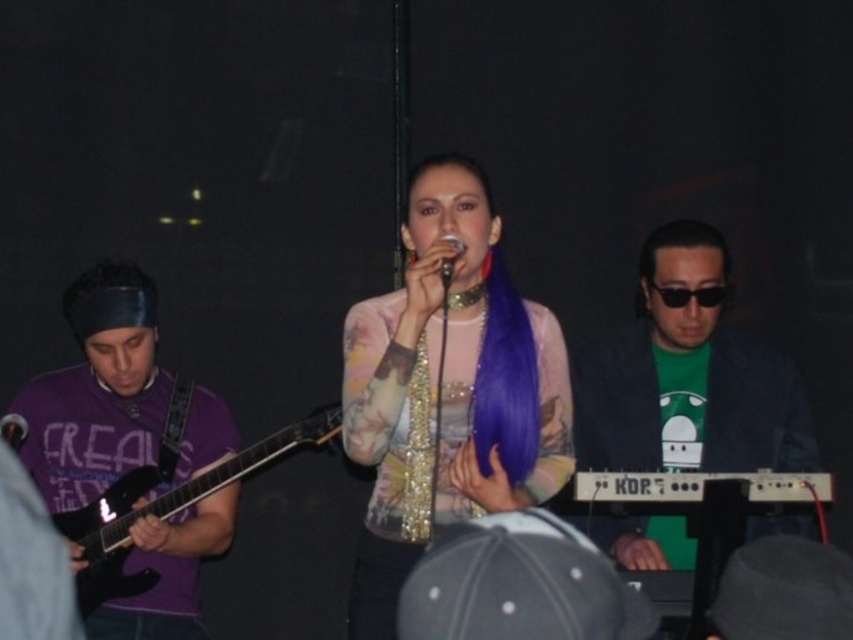
Is green matte keyboard at right bigger than purple matte guitar at left?

Indeed, green matte keyboard at right has a larger size compared to purple matte guitar at left.

Based on the photo, which is more to the left, green matte keyboard at right or purple matte guitar at left?

purple matte guitar at left

Does point (708, 326) lie behind point (198, 534)?

No, it is in front of (198, 534).

At what (x,y) coordinates should I click in order to perform the action: click on green matte keyboard at right. Please return your answer as a coordinate pair (x, y). This screenshot has height=640, width=853. Looking at the image, I should click on (688, 376).

In the scene shown: Does purple matte guitar at left have a larger size compared to metallic shiny microphone at center?

Correct, purple matte guitar at left is larger in size than metallic shiny microphone at center.

Identify the location of purple matte guitar at left. The width and height of the screenshot is (853, 640). (115, 397).

The width and height of the screenshot is (853, 640). Describe the element at coordinates (688, 376) in the screenshot. I see `green matte keyboard at right` at that location.

Find the location of a particular element. This screenshot has height=640, width=853. green matte keyboard at right is located at coordinates (688, 376).